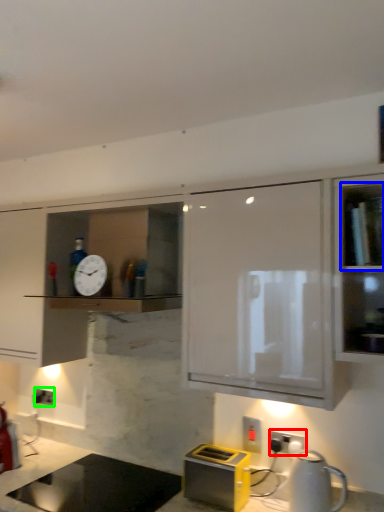
Question: Considering the real-world distances, which object is closest to electric outlet (highlighted by a red box)? shelf (highlighted by a blue box) or electric outlet (highlighted by a green box).

Choices:
 (A) shelf
 (B) electric outlet

Answer: (A)